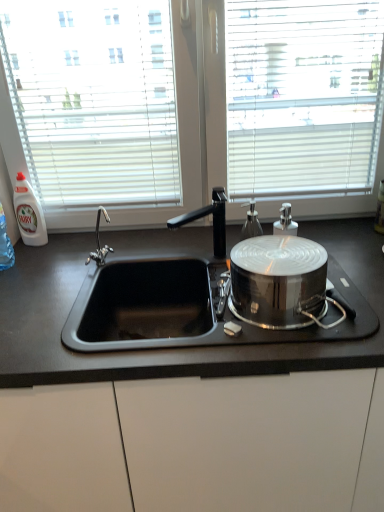
Question: From a real-world perspective, is black matte faucet at center on top of white plastic bottle at left, the first bottle positioned from the back?

Choices:
 (A) yes
 (B) no

Answer: (B)

Question: Is black matte faucet at center looking in the opposite direction of white plastic bottle at left, the 2th bottle in the front-to-back sequence?

Choices:
 (A) yes
 (B) no

Answer: (B)

Question: Does black matte faucet at center have a lesser height compared to white plastic bottle at left, the first bottle positioned from the back?

Choices:
 (A) yes
 (B) no

Answer: (A)

Question: Can you confirm if black matte faucet at center is smaller than white plastic bottle at left, arranged as the first bottle when viewed from the left?

Choices:
 (A) yes
 (B) no

Answer: (B)

Question: Can you confirm if black matte faucet at center is taller than white plastic bottle at left, marked as the 2th bottle in a right-to-left arrangement?

Choices:
 (A) yes
 (B) no

Answer: (B)

Question: Does point (316, 278) appear closer or farther from the camera than point (256, 229)?

Choices:
 (A) closer
 (B) farther

Answer: (A)

Question: In terms of width, does polished stainless steel pot at right look wider or thinner when compared to satin silver soap dispenser at center, which is the 1th bottle in front-to-back order?

Choices:
 (A) thin
 (B) wide

Answer: (B)

Question: In the image, is polished stainless steel pot at right on the left side or the right side of satin silver soap dispenser at center, marked as the 1th bottle in a right-to-left arrangement?

Choices:
 (A) left
 (B) right

Answer: (B)

Question: Is polished stainless steel pot at right in front of or behind satin silver soap dispenser at center, marked as the 2th bottle in a left-to-right arrangement, in the image?

Choices:
 (A) behind
 (B) front

Answer: (B)

Question: Is satin silver soap dispenser at center, marked as the 1th bottle in a right-to-left arrangement, spatially inside polished stainless steel pot at right, or outside of it?

Choices:
 (A) inside
 (B) outside

Answer: (B)

Question: Considering the positions of point (251, 215) and point (289, 290), is point (251, 215) closer or farther from the camera than point (289, 290)?

Choices:
 (A) closer
 (B) farther

Answer: (B)

Question: Based on their sizes in the image, would you say satin silver soap dispenser at center, the 2th bottle when ordered from back to front, is bigger or smaller than polished stainless steel pot at right?

Choices:
 (A) big
 (B) small

Answer: (B)

Question: From a real-world perspective, relative to polished stainless steel pot at right, is satin silver soap dispenser at center, marked as the 1th bottle in a right-to-left arrangement, vertically above or below?

Choices:
 (A) below
 (B) above

Answer: (B)

Question: Is black matte faucet at center wider or thinner than black matte countertop at center?

Choices:
 (A) wide
 (B) thin

Answer: (B)

Question: Does point (218, 201) appear closer or farther from the camera than point (205, 251)?

Choices:
 (A) closer
 (B) farther

Answer: (B)